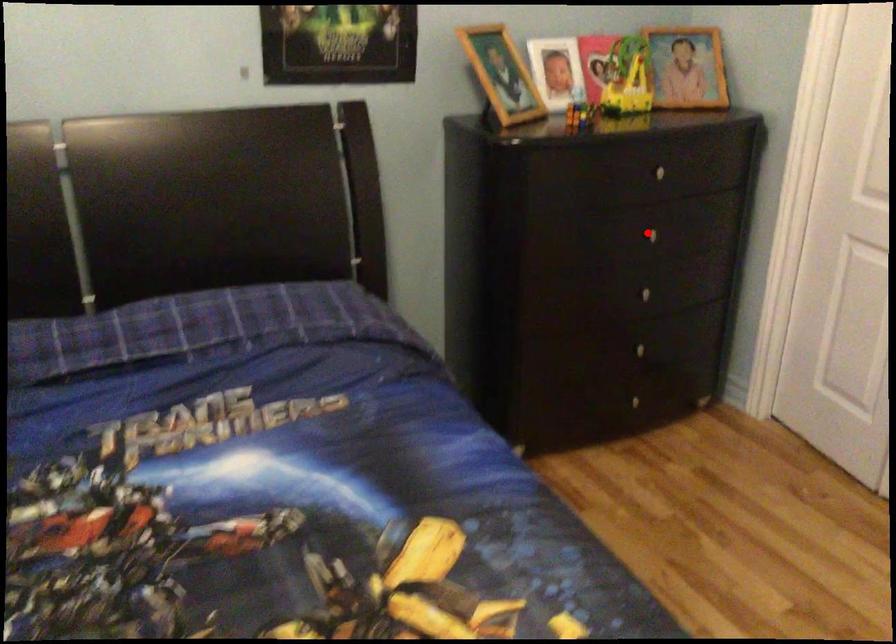
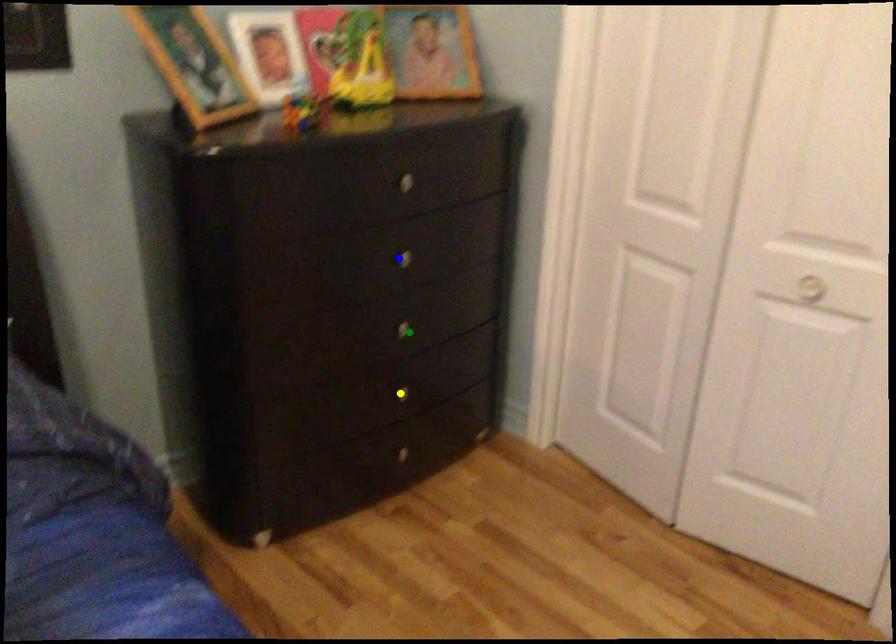
Question: I am providing you with two images of the same scene from different viewpoints. A red point is marked on the first image. You are given multiple points on the second image. Can you choose the point in image 2 that corresponds to the point in image 1?

Choices:
 (A) yellow point
 (B) blue point
 (C) green point

Answer: (B)